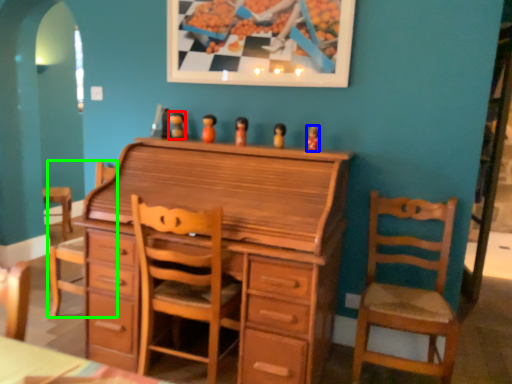
Question: Estimate the real-world distances between objects in this image. Which object is farther from toy (highlighted by a red box), toy (highlighted by a blue box) or swivel chair (highlighted by a green box)?

Choices:
 (A) toy
 (B) swivel chair

Answer: (B)